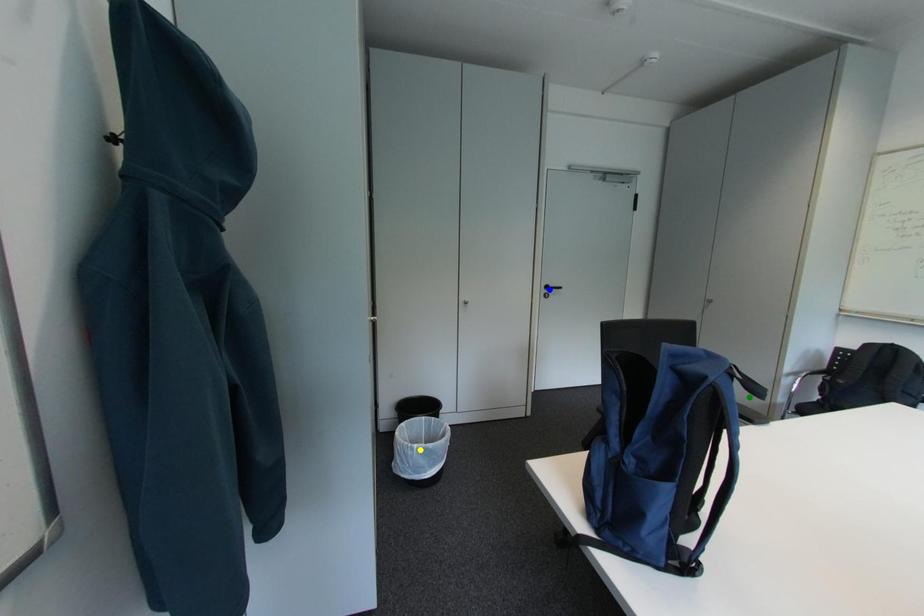
Order these from nearest to farthest:
yellow point | blue point | green point

green point < yellow point < blue point